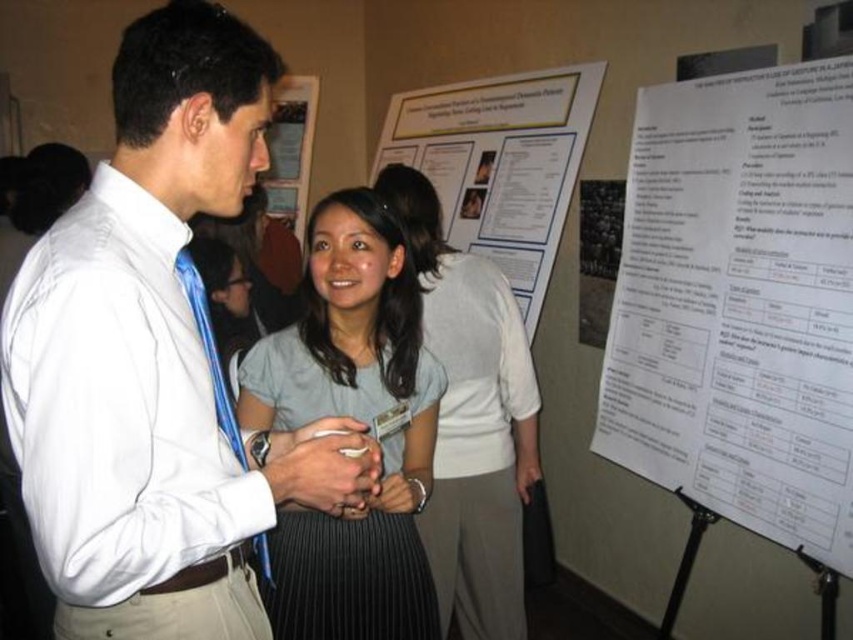
Question: Among these objects, which one is farthest from the camera?

Choices:
 (A) white paper at upper right
 (B) light gray fabric shirt at center

Answer: (B)

Question: Does light gray fabric shirt at center have a lesser width compared to white paper at center?

Choices:
 (A) no
 (B) yes

Answer: (A)

Question: Is light gray fabric shirt at center to the right of white paper poster at center from the viewer's perspective?

Choices:
 (A) yes
 (B) no

Answer: (B)

Question: Which of these objects is positioned closest to the white paper poster at center?

Choices:
 (A) white paper at center
 (B) white shirt at center
 (C) light gray fabric shirt at center

Answer: (C)

Question: Which point is farther to the camera?

Choices:
 (A) (312, 129)
 (B) (741, 108)

Answer: (A)

Question: Does light gray fabric shirt at center have a smaller size compared to white paper at center?

Choices:
 (A) no
 (B) yes

Answer: (A)